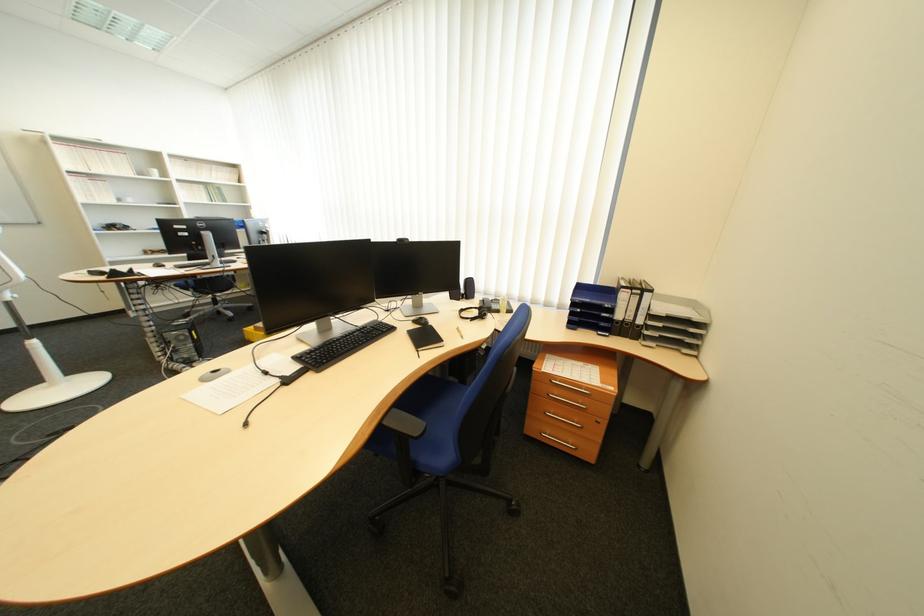
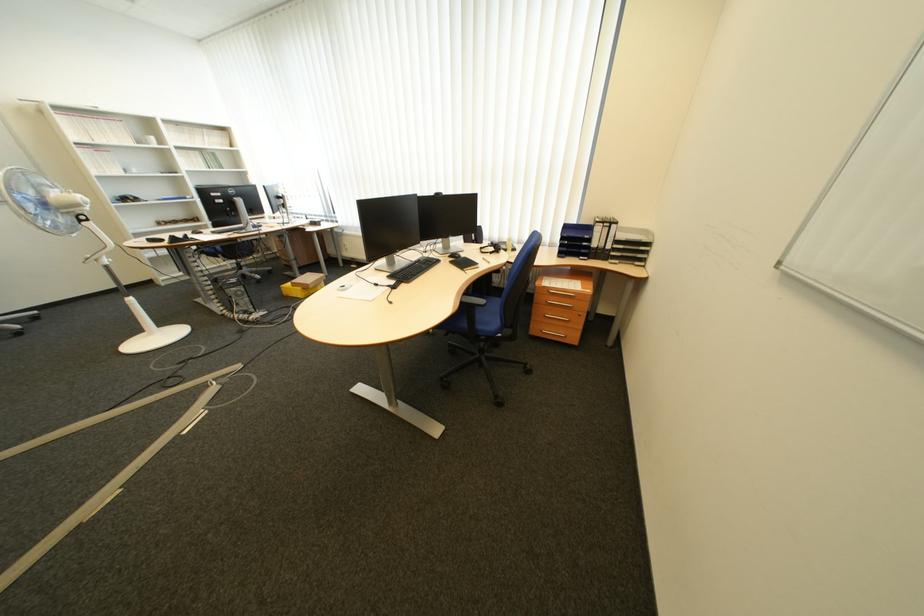
The point at [543,405] is marked in the first image. Where is the corresponding point in the second image?

(546, 313)